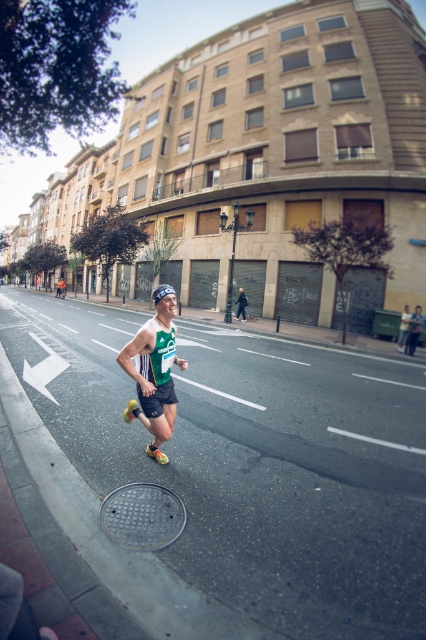
Which is more to the right, green fabric runner at center or gray metallic manhole cover at lower center?

From the viewer's perspective, green fabric runner at center appears more on the right side.

Does green fabric runner at center have a lesser height compared to gray metallic manhole cover at lower center?

In fact, green fabric runner at center may be taller than gray metallic manhole cover at lower center.

Is point (155, 344) more distant than point (117, 492)?

Yes.

Locate an element on the screen. green fabric runner at center is located at coordinates (154, 371).